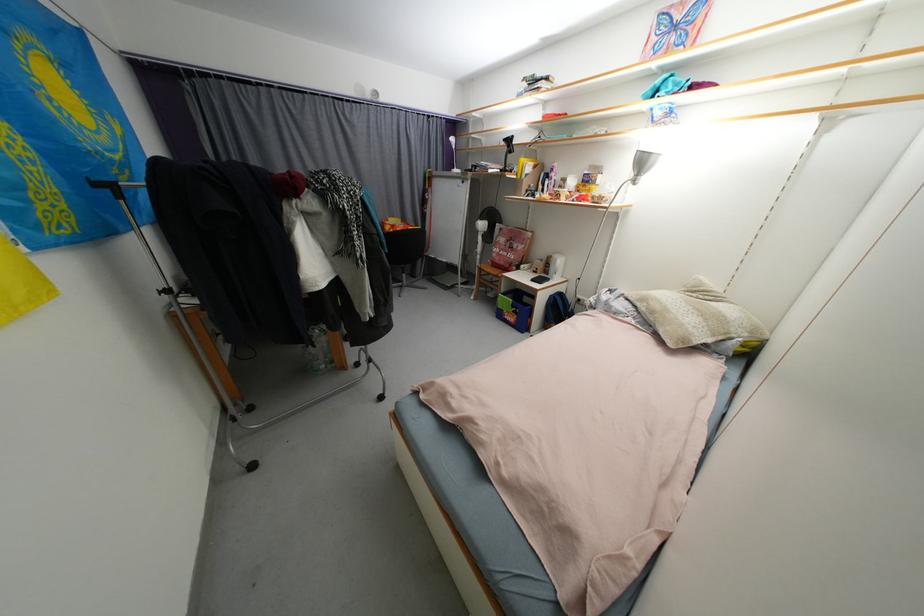
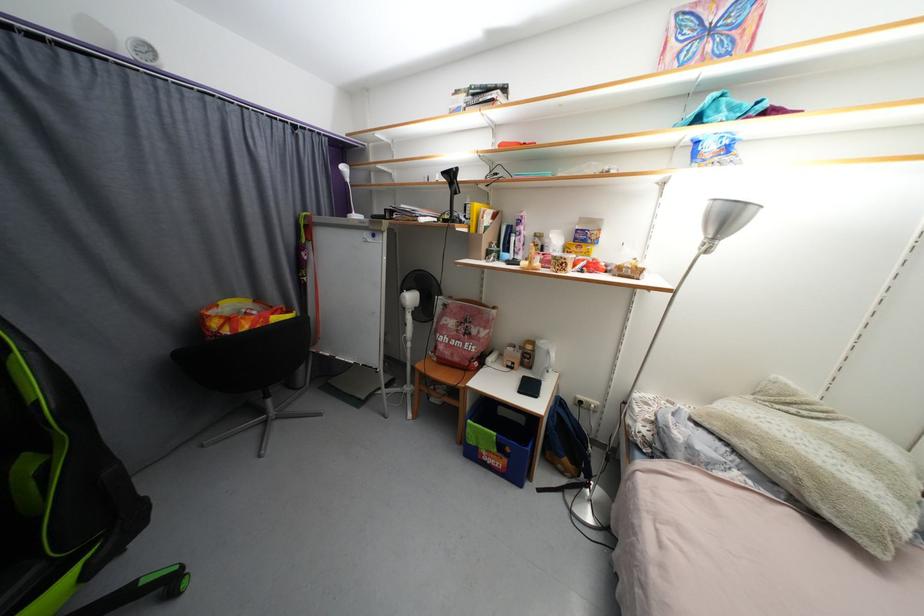
Question: What movement of the cameraman would produce the second image?

Choices:
 (A) Left
 (B) Right
 (C) Forward
 (D) Backward

Answer: (C)